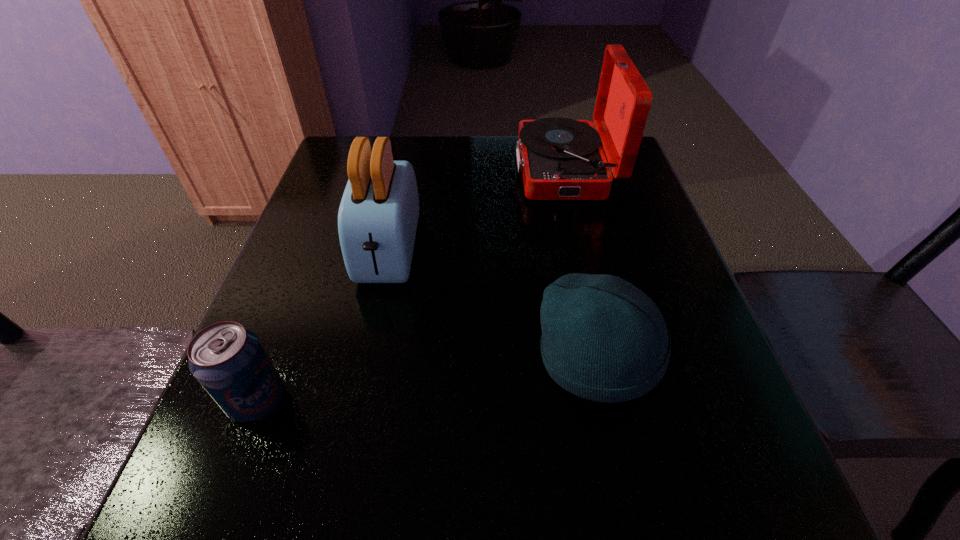
You are a GUI agent. You are given a task and a screenshot of the screen. Output one action in this format:
    pyautogui.click(x=<x>, y=<y>)
    Task: Click on the free space between the beanie and the second farthest object
    
    Given the screenshot: What is the action you would take?
    pyautogui.click(x=493, y=305)

Locate an element on the screen. The image size is (960, 540). empty space between the second farthest object and the phonograph_record is located at coordinates (476, 211).

Where is `vacant space in between the phonograph_record and the second object from left to right`? vacant space in between the phonograph_record and the second object from left to right is located at coordinates (476, 211).

Identify the location of vacant area between the third nearest object and the pop soda. This screenshot has width=960, height=540. (324, 326).

Locate an element on the screen. vacant area that lies between the second object from left to right and the leftmost object is located at coordinates (324, 326).

The image size is (960, 540). Identify the location of free space that is in between the farthest object and the leftmost object. [411, 285].

Where is `unoccupied position between the pop soda and the toaster`? This screenshot has width=960, height=540. unoccupied position between the pop soda and the toaster is located at coordinates (324, 326).

You are a GUI agent. You are given a task and a screenshot of the screen. Output one action in this format:
    pyautogui.click(x=<x>, y=<y>)
    Task: Click on the vacant space that's between the third object from right to left and the beanie
    
    Given the screenshot: What is the action you would take?
    pyautogui.click(x=493, y=305)

Find the location of a particular element. Image resolution: width=960 pixels, height=540 pixels. free area in between the farthest object and the leftmost object is located at coordinates (411, 285).

This screenshot has height=540, width=960. I want to click on vacant point located between the leftmost object and the beanie, so click(427, 380).